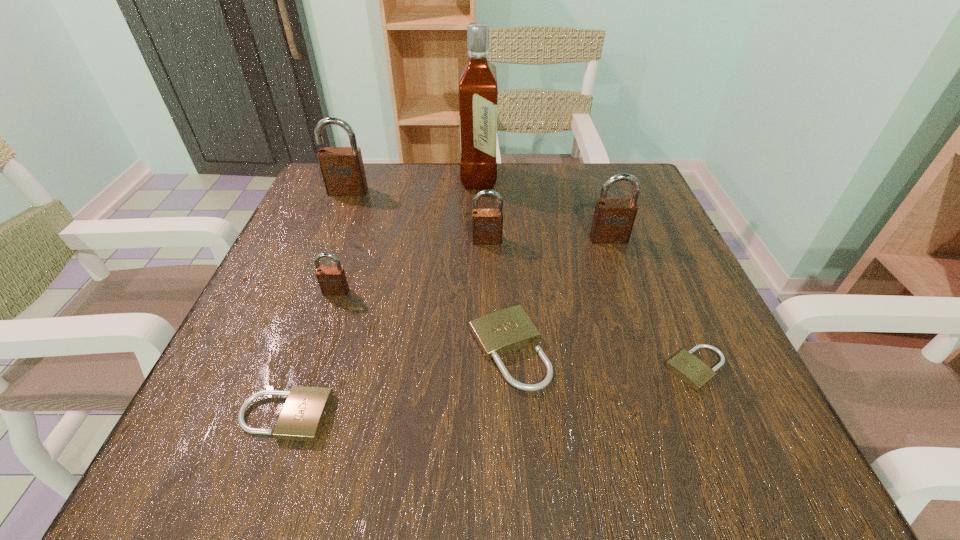
I want to click on vacant space at the left edge of the desktop, so click(x=277, y=300).

Identify the location of blank space at the right edge of the desktop. Image resolution: width=960 pixels, height=540 pixels. (636, 253).

I want to click on blank space at the far left corner of the desktop, so click(317, 214).

You are a GUI agent. You are given a task and a screenshot of the screen. Output one action in this format:
    pyautogui.click(x=<x>, y=<y>)
    Task: Click on the vacant space at the far right corner
    The height and width of the screenshot is (540, 960).
    Given the screenshot: What is the action you would take?
    pyautogui.click(x=581, y=173)

You are a GUI agent. You are given a task and a screenshot of the screen. Output one action in this format:
    pyautogui.click(x=<x>, y=<y>)
    Task: Click on the free space between the smallest beige padlock and the fourth tallest object
    This screenshot has height=540, width=960.
    Given the screenshot: What is the action you would take?
    pyautogui.click(x=591, y=305)

This screenshot has width=960, height=540. I want to click on vacant area between the second brown padlock from right to left and the third tallest object, so click(x=548, y=240).

Identify the location of free space that is in between the second tallest object and the third biggest brown padlock. Image resolution: width=960 pixels, height=540 pixels. (418, 216).

Locate an element on the screen. free space between the fourth tallest object and the third shortest object is located at coordinates (498, 295).

In order to click on vacant point located between the fourth nearest padlock and the tallest padlock in this screenshot , I will do `click(342, 242)`.

The image size is (960, 540). What are the coordinates of `vacant space that's between the smallest beige padlock and the biggest brown padlock` in the screenshot? It's located at (522, 280).